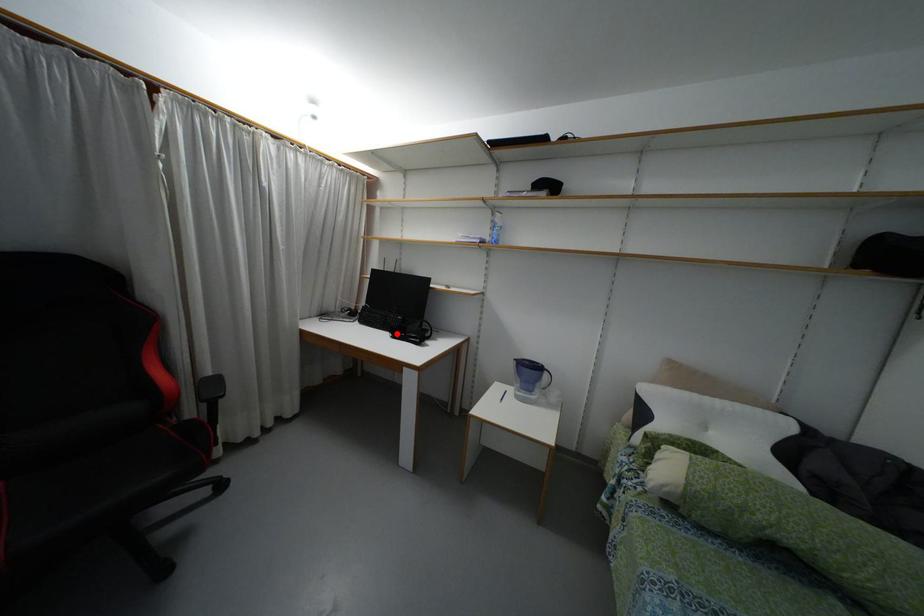
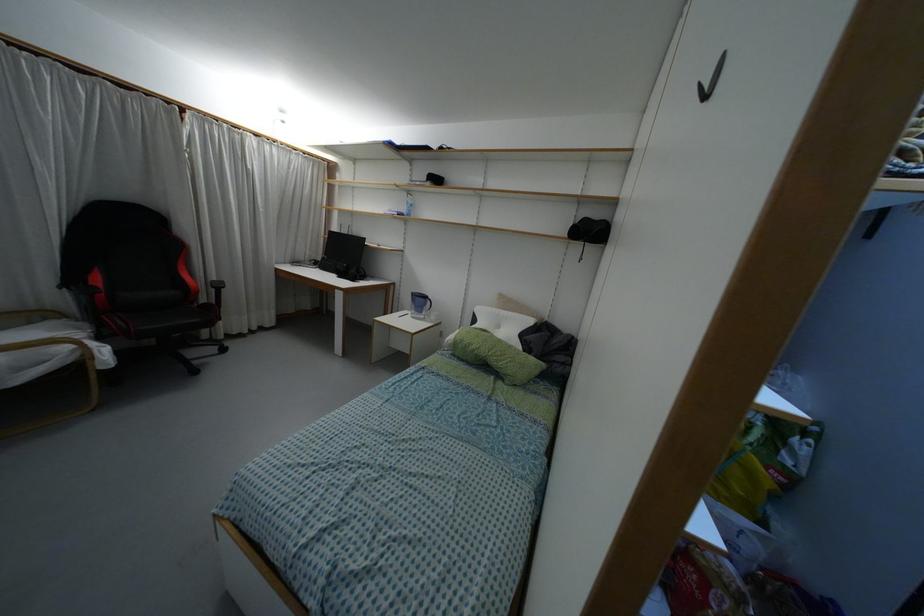
Locate, in the second image, the point that corresponds to the highlighted location in the first image.

(341, 275)